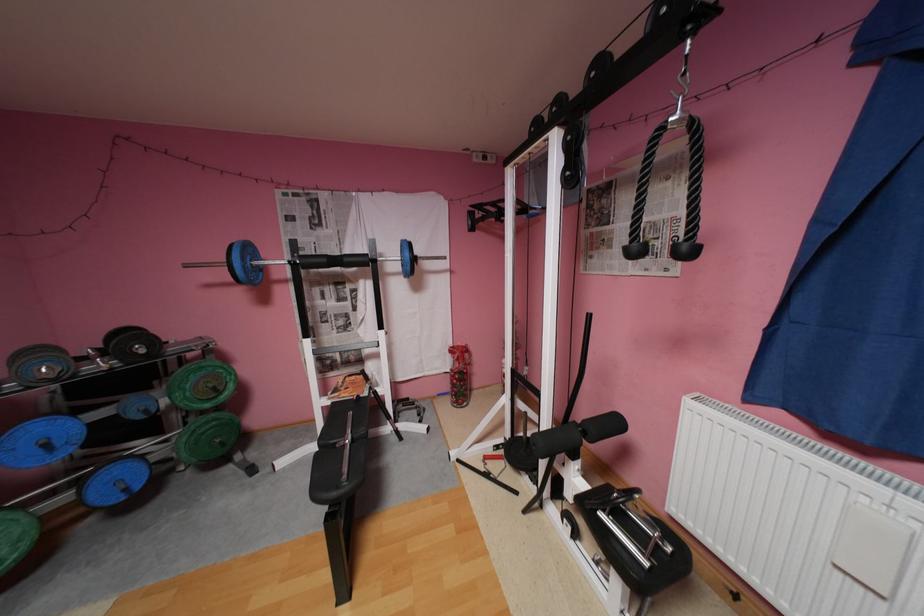
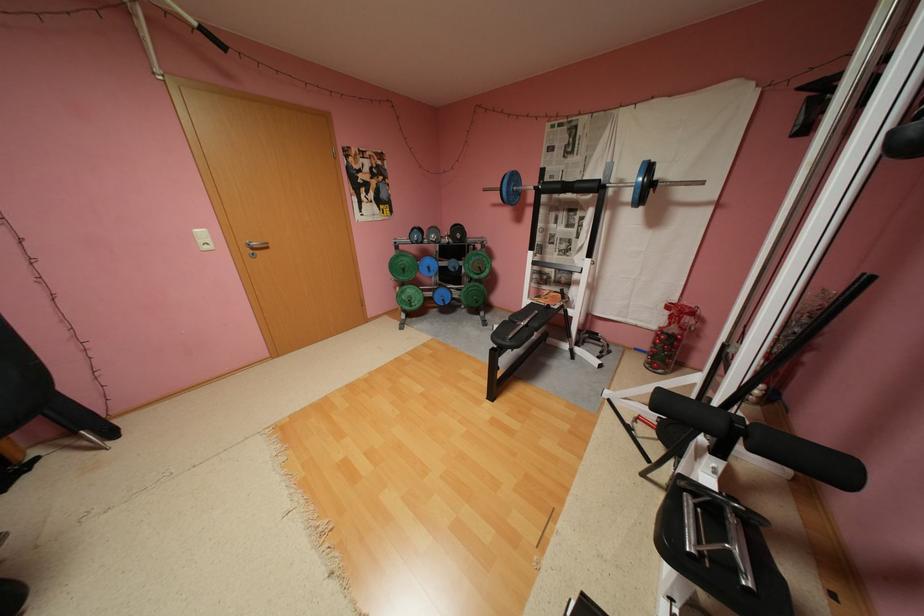
In the second image, find the point that corresponds to (x=355, y=259) in the first image.

(586, 185)